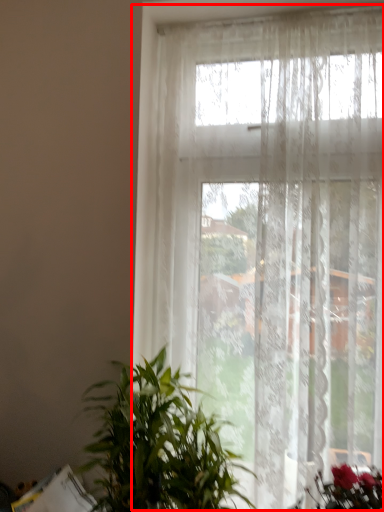
Question: From the image, what is the correct spatial relationship of window (annotated by the red box) in relation to houseplant?

Choices:
 (A) left
 (B) right

Answer: (B)